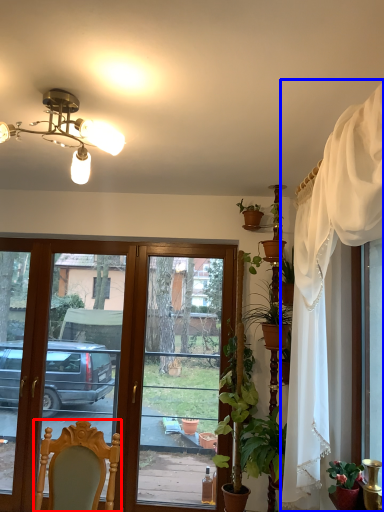
Question: Among these objects, which one is nearest to the camera, chair (highlighted by a red box) or curtain (highlighted by a blue box)?

Choices:
 (A) chair
 (B) curtain

Answer: (B)